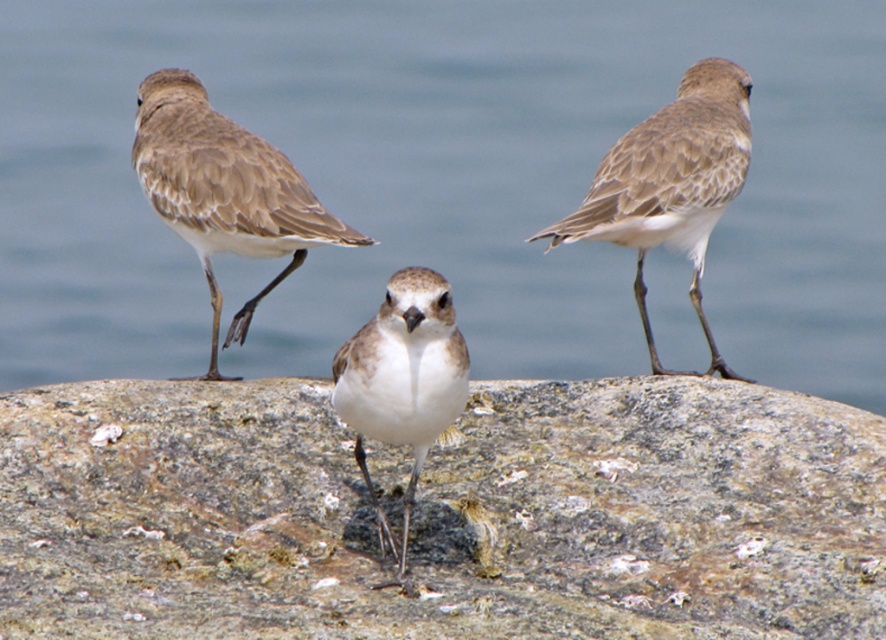
You are a birdwatcher observing the scene. You notice the rough textured rock at center and the brown speckled feathers at upper right. Which object is larger in size?

The rough textured rock at center is bigger than brown speckled feathers at upper right according to the description.

You are a photographer trying to capture the brown speckled feathers at left and the rough textured rock at center in a single frame. Based on their positions, which object should you adjust your camera focus to first to ensure both are in focus?

The rough textured rock at center is to the right of brown speckled feathers at left, so you should focus on the brown speckled feathers at left first since it is closer to the camera. This will ensure the foreground bird is in focus while the rock, being further away, might still be within the depth of field.